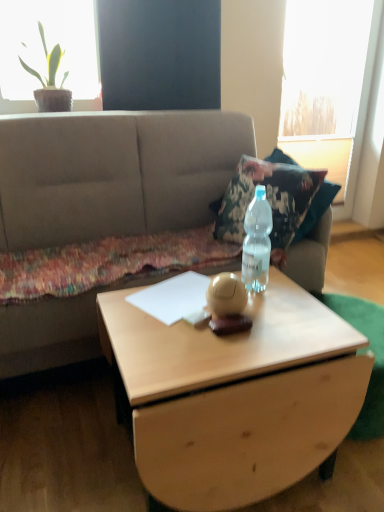
Question: Can you confirm if beige fabric couch at center is smaller than green leafy plant at upper left?

Choices:
 (A) yes
 (B) no

Answer: (B)

Question: From a real-world perspective, does beige fabric couch at center sit lower than green leafy plant at upper left?

Choices:
 (A) yes
 (B) no

Answer: (A)

Question: Is beige fabric couch at center further to the viewer compared to green leafy plant at upper left?

Choices:
 (A) yes
 (B) no

Answer: (B)

Question: Does beige fabric couch at center have a lesser height compared to green leafy plant at upper left?

Choices:
 (A) yes
 (B) no

Answer: (B)

Question: Does beige fabric couch at center come in front of green leafy plant at upper left?

Choices:
 (A) no
 (B) yes

Answer: (B)

Question: From a real-world perspective, is beige fabric couch at center physically above green leafy plant at upper left?

Choices:
 (A) yes
 (B) no

Answer: (B)

Question: Is light wood coffee table at center oriented away from beige fabric couch at center?

Choices:
 (A) no
 (B) yes

Answer: (B)

Question: Is light wood coffee table at center in contact with beige fabric couch at center?

Choices:
 (A) yes
 (B) no

Answer: (B)

Question: From a real-world perspective, is light wood coffee table at center below beige fabric couch at center?

Choices:
 (A) no
 (B) yes

Answer: (B)

Question: Does light wood coffee table at center have a smaller size compared to beige fabric couch at center?

Choices:
 (A) no
 (B) yes

Answer: (B)

Question: From the image's perspective, is light wood coffee table at center located above beige fabric couch at center?

Choices:
 (A) no
 (B) yes

Answer: (A)

Question: Considering the relative positions of light wood coffee table at center and beige fabric couch at center in the image provided, is light wood coffee table at center in front of beige fabric couch at center?

Choices:
 (A) yes
 (B) no

Answer: (A)

Question: From the image's perspective, is light wood coffee table at center beneath green leafy plant at upper left?

Choices:
 (A) no
 (B) yes

Answer: (B)